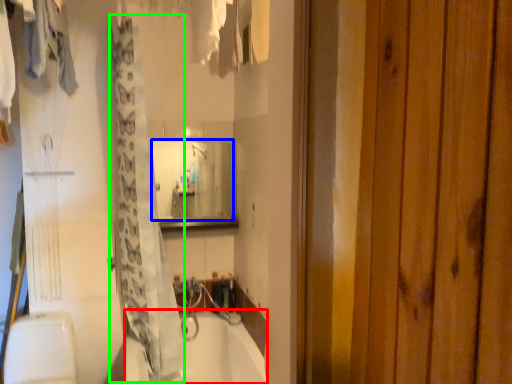
Question: Which object is positioned farthest from bathtub (highlighted by a red box)? Select from mirror (highlighted by a blue box) and shower curtain (highlighted by a green box).

Choices:
 (A) mirror
 (B) shower curtain

Answer: (A)